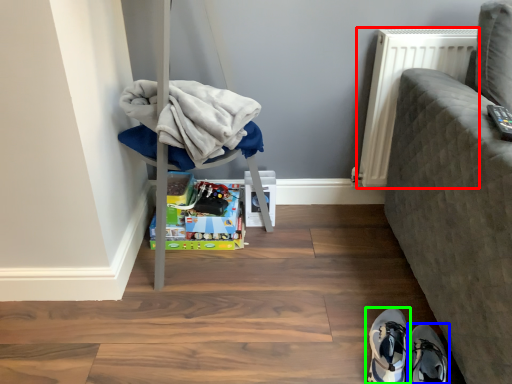
Question: Based on their relative distances, which object is farther from radiator (highlighted by a red box)? Choose from footwear (highlighted by a blue box) and footwear (highlighted by a green box).

Choices:
 (A) footwear
 (B) footwear

Answer: (A)